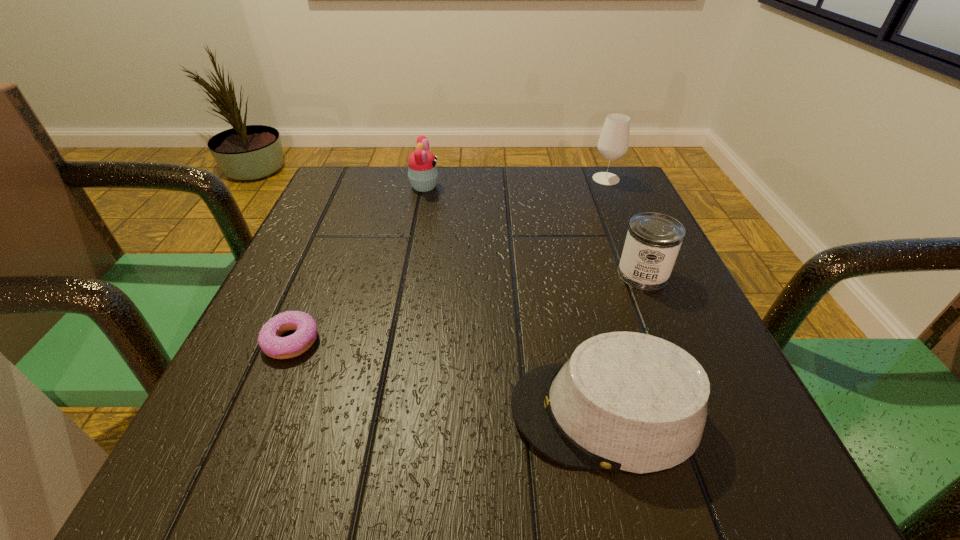
This screenshot has width=960, height=540. In order to click on free spot that satisfies the following two spatial constraints: 1. on the face of the can; 2. on the left side of the cupcake in this screenshot , I will do [x=408, y=274].